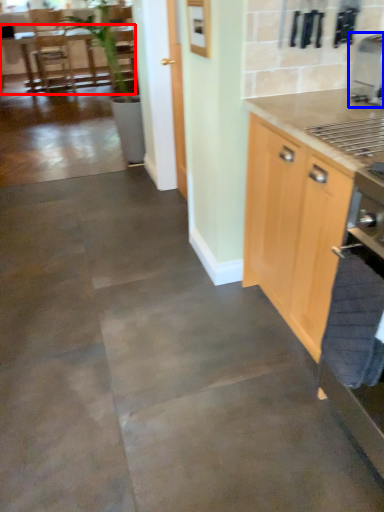
Question: Which point is closer to the camera, table (highlighted by a red box) or coffee machine (highlighted by a blue box)?

Choices:
 (A) table
 (B) coffee machine

Answer: (B)